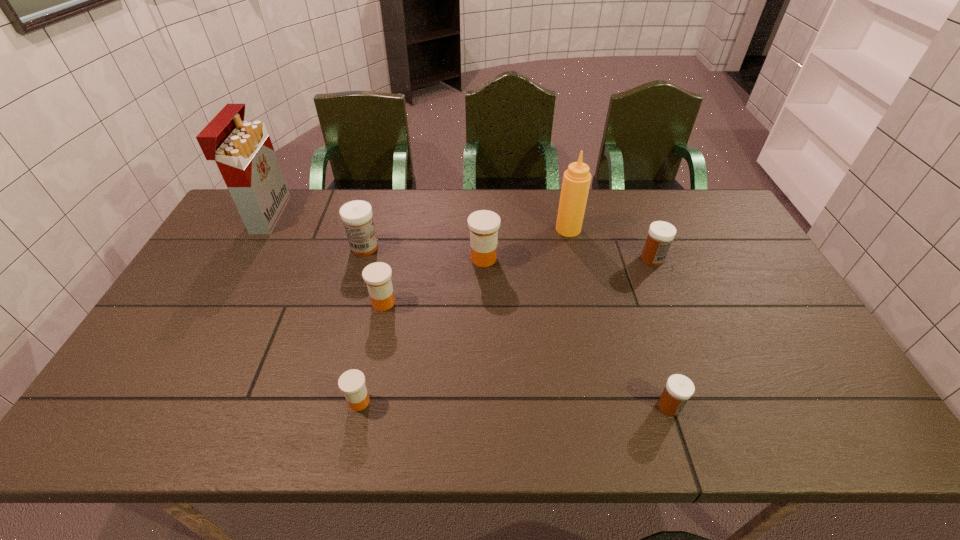
I want to click on red cigarette case, so click(x=243, y=151).

The height and width of the screenshot is (540, 960). What are the coordinates of `the tallest object` in the screenshot? It's located at (243, 151).

The image size is (960, 540). Identify the location of the third object from right to left. (576, 180).

Identify the location of condiment. This screenshot has width=960, height=540. (576, 180).

Find the location of `the fifth object from left to right`. the fifth object from left to right is located at coordinates (483, 224).

Where is `the farthest orange medicine`? Image resolution: width=960 pixels, height=540 pixels. the farthest orange medicine is located at coordinates (483, 224).

This screenshot has height=540, width=960. I want to click on the second object from left to right, so coord(356,215).

Image resolution: width=960 pixels, height=540 pixels. In order to click on the leftmost medicine in this screenshot , I will do `click(356, 215)`.

What are the coordinates of `the second biggest orange medicine` in the screenshot? It's located at (377, 276).

Locate an element on the screen. The height and width of the screenshot is (540, 960). the second farthest orange medicine is located at coordinates (377, 276).